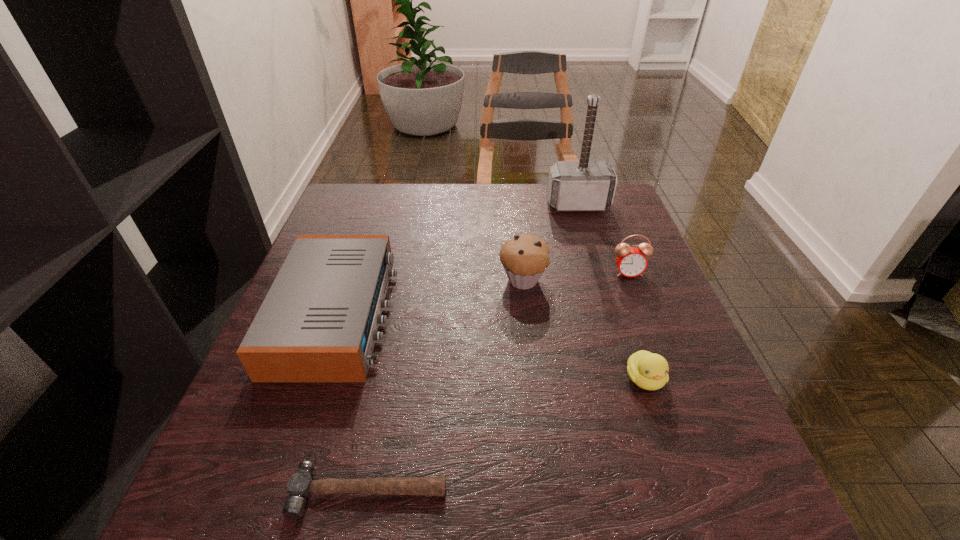
You are a GUI agent. You are given a task and a screenshot of the screen. Output one action in this format:
    pyautogui.click(x=<x>, y=<y>)
    Task: Click on the free space in the image that satisfies the following two spatial constraints: 1. for striking with the head of the farthest object; 2. on the front panel of the radio receiver
    The height and width of the screenshot is (540, 960).
    Given the screenshot: What is the action you would take?
    pyautogui.click(x=612, y=315)

I want to click on free location that satisfies the following two spatial constraints: 1. for striking with the head of the tallest object; 2. on the front panel of the radio receiver, so click(x=612, y=315).

Where is `free space that satisfies the following two spatial constraints: 1. for striking with the head of the farther hammer; 2. on the front panel of the radio receiver`? free space that satisfies the following two spatial constraints: 1. for striking with the head of the farther hammer; 2. on the front panel of the radio receiver is located at coordinates (612, 315).